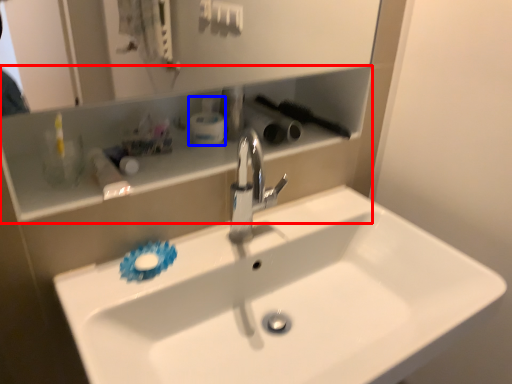
Question: Which of the following is the farthest to the observer, shelve (highlighted by a red box) or toiletry (highlighted by a blue box)?

Choices:
 (A) shelve
 (B) toiletry

Answer: (B)